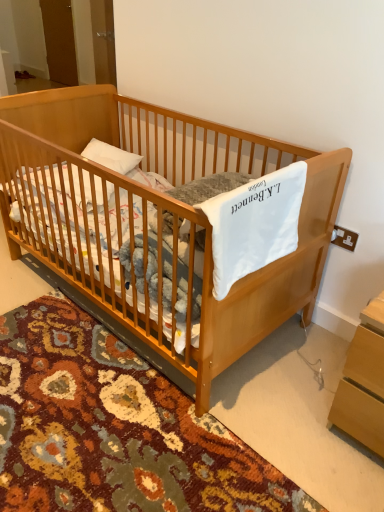
Question: Can white soft blanket at center be found inside light brown wooden crib at center?

Choices:
 (A) no
 (B) yes

Answer: (B)

Question: Considering the relative sizes of light brown wooden crib at center and white soft blanket at center in the image provided, is light brown wooden crib at center shorter than white soft blanket at center?

Choices:
 (A) no
 (B) yes

Answer: (A)

Question: Are light brown wooden crib at center and white soft blanket at center beside each other?

Choices:
 (A) yes
 (B) no

Answer: (B)

Question: Considering the relative sizes of light brown wooden crib at center and white soft blanket at center in the image provided, is light brown wooden crib at center thinner than white soft blanket at center?

Choices:
 (A) yes
 (B) no

Answer: (B)

Question: Can you confirm if light brown wooden crib at center is taller than white soft blanket at center?

Choices:
 (A) no
 (B) yes

Answer: (B)

Question: In terms of height, does light brown wooden changing table at lower right look taller or shorter compared to light brown wooden crib at center?

Choices:
 (A) tall
 (B) short

Answer: (B)

Question: Is light brown wooden changing table at lower right inside the boundaries of light brown wooden crib at center, or outside?

Choices:
 (A) inside
 (B) outside

Answer: (B)

Question: Is point (352, 337) closer or farther from the camera than point (205, 287)?

Choices:
 (A) closer
 (B) farther

Answer: (B)

Question: Looking at their shapes, would you say light brown wooden changing table at lower right is wider or thinner than light brown wooden crib at center?

Choices:
 (A) wide
 (B) thin

Answer: (B)

Question: Considering the positions of light brown wooden crib at center and light brown wooden changing table at lower right in the image, is light brown wooden crib at center bigger or smaller than light brown wooden changing table at lower right?

Choices:
 (A) big
 (B) small

Answer: (A)

Question: Relative to light brown wooden changing table at lower right, is light brown wooden crib at center in front or behind?

Choices:
 (A) front
 (B) behind

Answer: (A)

Question: From a real-world perspective, is light brown wooden crib at center above or below light brown wooden changing table at lower right?

Choices:
 (A) above
 (B) below

Answer: (A)

Question: Considering the positions of point (240, 133) and point (375, 387), is point (240, 133) closer or farther from the camera than point (375, 387)?

Choices:
 (A) farther
 (B) closer

Answer: (A)

Question: From a real-world perspective, is light brown wooden crib at center physically located above or below white soft blanket at center?

Choices:
 (A) below
 (B) above

Answer: (A)

Question: From the image's perspective, is light brown wooden crib at center above or below white soft blanket at center?

Choices:
 (A) above
 (B) below

Answer: (A)